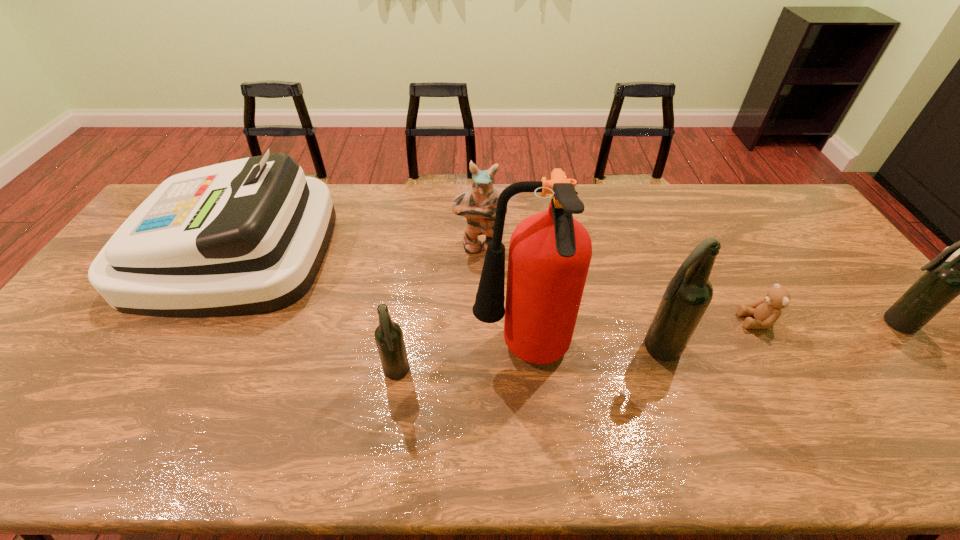
Given the evenly spaced beer bottles in the image, where should an extra beer bottle be added on the left to preserve the spacing? Please point to a vacant space. Please provide its 2D coordinates. Your answer should be formatted as a tuple, i.e. [(x, y)], where the tuple contains the x and y coordinates of a point satisfying the conditions above.

[(108, 403)]